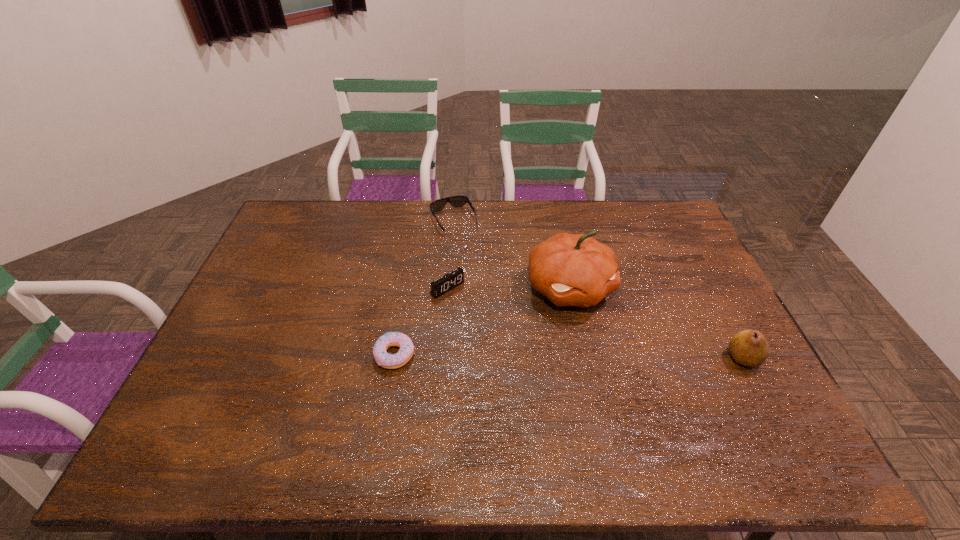
At what (x,y) coordinates should I click in order to perform the action: click on blank space located on the front-facing side of the farthest object. Please return your answer as a coordinate pair (x, y). Image resolution: width=960 pixels, height=540 pixels. Looking at the image, I should click on (476, 264).

This screenshot has width=960, height=540. Find the location of `vacant space located 0.180m on the front-facing side of the farthest object`. vacant space located 0.180m on the front-facing side of the farthest object is located at coordinates (479, 268).

The height and width of the screenshot is (540, 960). In order to click on free region located 0.090m on the front-facing side of the alarm clock in this screenshot , I will do `click(476, 314)`.

I want to click on vacant space situated 0.050m on the front-facing side of the alarm clock, so click(468, 306).

Identify the location of vacant space situated 0.240m on the front-facing side of the alarm clock. (511, 345).

You are a GUI agent. You are given a task and a screenshot of the screen. Output one action in this format:
    pyautogui.click(x=<x>, y=<y>)
    Task: Click on the vacant point located on the front face of the tallest object
    This screenshot has width=960, height=540.
    Given the screenshot: What is the action you would take?
    (x=610, y=348)

Where is `free space located on the front face of the tallest object`? Image resolution: width=960 pixels, height=540 pixels. free space located on the front face of the tallest object is located at coordinates tap(606, 342).

The width and height of the screenshot is (960, 540). I want to click on free spot located on the front face of the tallest object, so click(608, 345).

Identify the location of object that is at the far edge. (456, 201).

In order to click on object that is at the right edge in this screenshot , I will do `click(749, 348)`.